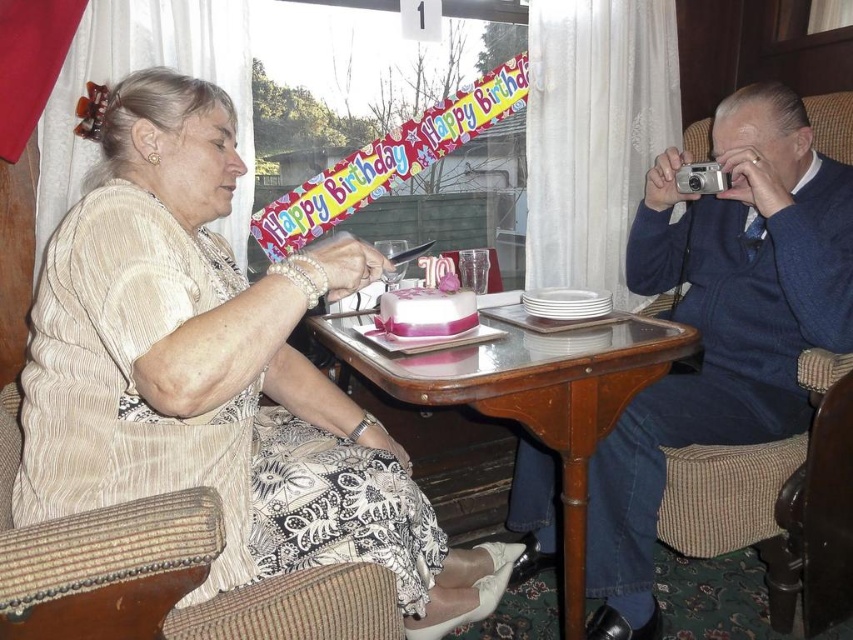
Is the position of blue sweater at right less distant than that of wooden table at center?

No.

Image resolution: width=853 pixels, height=640 pixels. What do you see at coordinates (721, 324) in the screenshot?
I see `blue sweater at right` at bounding box center [721, 324].

You are a GUI agent. You are given a task and a screenshot of the screen. Output one action in this format:
    pyautogui.click(x=<x>, y=<y>)
    Task: Click on the blue sweater at right
    This screenshot has width=853, height=640.
    Given the screenshot: What is the action you would take?
    click(x=721, y=324)

Which is in front, point (531, 397) or point (430, 316)?

Positioned in front is point (531, 397).

Is the position of wooden table at center more distant than that of smooth pink cake at center?

No, wooden table at center is closer to the viewer.

At what (x,y) coordinates should I click in order to perform the action: click on wooden table at center. Please return your answer as a coordinate pair (x, y). Looking at the image, I should click on (534, 396).

Does matte beige blouse at upper left have a lesser width compared to blue sweater at right?

In fact, matte beige blouse at upper left might be wider than blue sweater at right.

Is the position of matte beige blouse at upper left less distant than that of blue sweater at right?

Yes, it is.

Describe the element at coordinates (218, 374) in the screenshot. I see `matte beige blouse at upper left` at that location.

Locate an element on the screen. Image resolution: width=853 pixels, height=640 pixels. matte beige blouse at upper left is located at coordinates (218, 374).